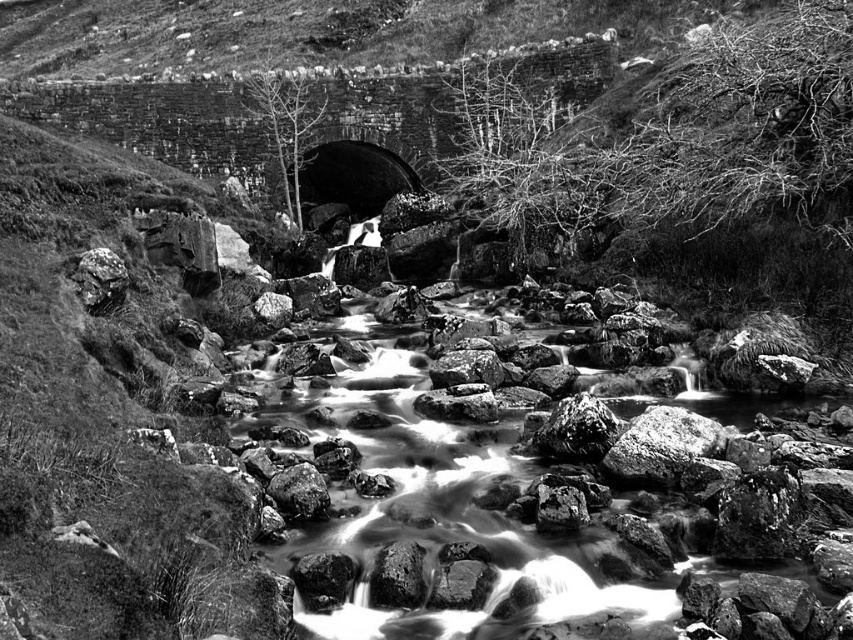
You are standing at the edge of the stream and want to place a small pebble on the rough textured rock at upper left and the rough textured rock at center. Which rock should you aim for if you want to place the pebble closer to your current position?

You should aim for the rough textured rock at upper left because it is closer to you than the rough textured rock at center.

You are standing at the edge of the stream and notice two rocks in the scene. The first is the rough textured rock at upper left, and the second is the rough textured rock at center. From your vantage point, which of these rocks is positioned more to the left?

The rough textured rock at upper left is positioned to the left of the rough textured rock at center, so the rough textured rock at upper left is more to the left.